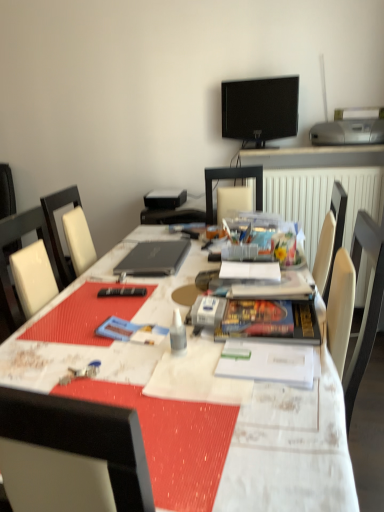
Question: Should I look upward or downward to see black glossy tv at upper center?

Choices:
 (A) down
 (B) up

Answer: (B)

Question: Considering the relative positions of white textured table at center and black glossy tv at upper center in the image provided, is white textured table at center to the right of black glossy tv at upper center from the viewer's perspective?

Choices:
 (A) yes
 (B) no

Answer: (B)

Question: From the image's perspective, is white textured table at center on black glossy tv at upper center?

Choices:
 (A) yes
 (B) no

Answer: (B)

Question: Does white textured table at center lie in front of black glossy tv at upper center?

Choices:
 (A) no
 (B) yes

Answer: (B)

Question: Can you confirm if white textured table at center is positioned to the left of black glossy tv at upper center?

Choices:
 (A) no
 (B) yes

Answer: (B)

Question: Are white textured table at center and black glossy tv at upper center beside each other?

Choices:
 (A) yes
 (B) no

Answer: (B)

Question: Is white textured table at center thinner than black glossy tv at upper center?

Choices:
 (A) yes
 (B) no

Answer: (B)

Question: Is black matte laptop at center to the right of blue matte paperback book at center, which ranks as the 1th paperback book in left-to-right order, from the viewer's perspective?

Choices:
 (A) no
 (B) yes

Answer: (B)

Question: Is black matte laptop at center in contact with blue matte paperback book at center, arranged as the second paperback book when viewed from the right?

Choices:
 (A) no
 (B) yes

Answer: (A)

Question: Is black matte laptop at center thinner than blue matte paperback book at center, arranged as the second paperback book when viewed from the right?

Choices:
 (A) yes
 (B) no

Answer: (B)

Question: Is black matte laptop at center wider than blue matte paperback book at center, which ranks as the 1th paperback book in left-to-right order?

Choices:
 (A) yes
 (B) no

Answer: (A)

Question: Can you confirm if black matte laptop at center is taller than blue matte paperback book at center, arranged as the second paperback book when viewed from the right?

Choices:
 (A) yes
 (B) no

Answer: (A)

Question: Is black matte laptop at center at the left side of blue matte paperback book at center, arranged as the second paperback book when viewed from the right?

Choices:
 (A) no
 (B) yes

Answer: (A)

Question: Is white plastic glue at center next to blue matte paperback book at center, arranged as the second paperback book when viewed from the right, and touching it?

Choices:
 (A) yes
 (B) no

Answer: (B)